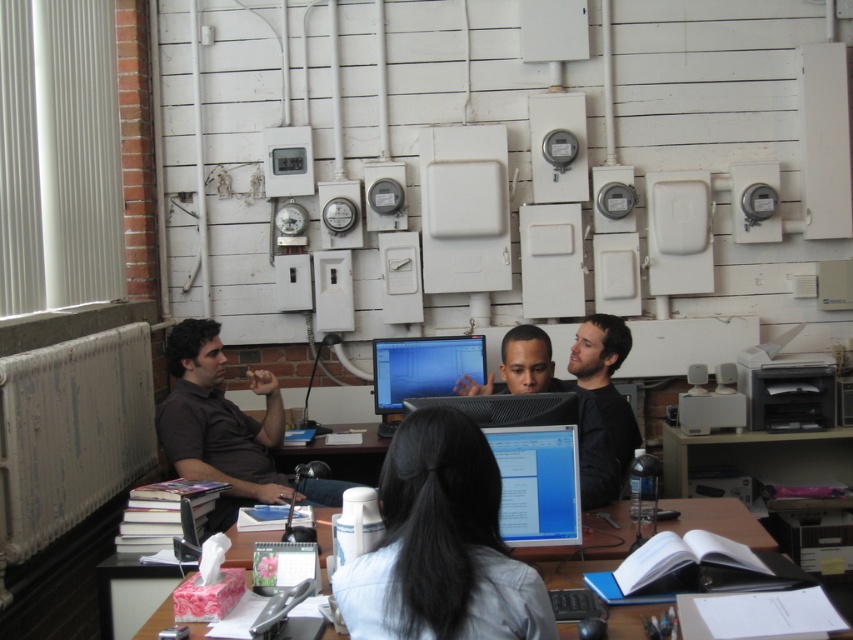
What object is located at the coordinates point (421, 371)?

The point (421, 371) corresponds to the matte black monitor at center.